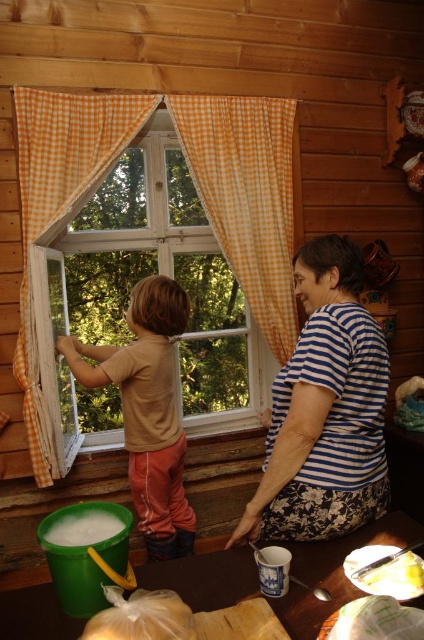
You are a delivery robot with a package that is 40 centimeters wide. You need to deliver the package through the gap between the clear glass window at center and orange checkered curtain at center. Will the package fit through the gap?

The gap between the clear glass window at center and orange checkered curtain at center is 37.56 centimeters. Since the package is 40 centimeters wide, it is wider than the available space. The package will not fit through the gap.

You are standing at the point marked as point (181,408) in the cabin. The window with white frame is directly in front of you. If you walk straight towards the window, will you be able to reach it before the wall?

Yes, because the distance between you and the window is less than 2.53 meters, so you can reach the window before hitting the wall.